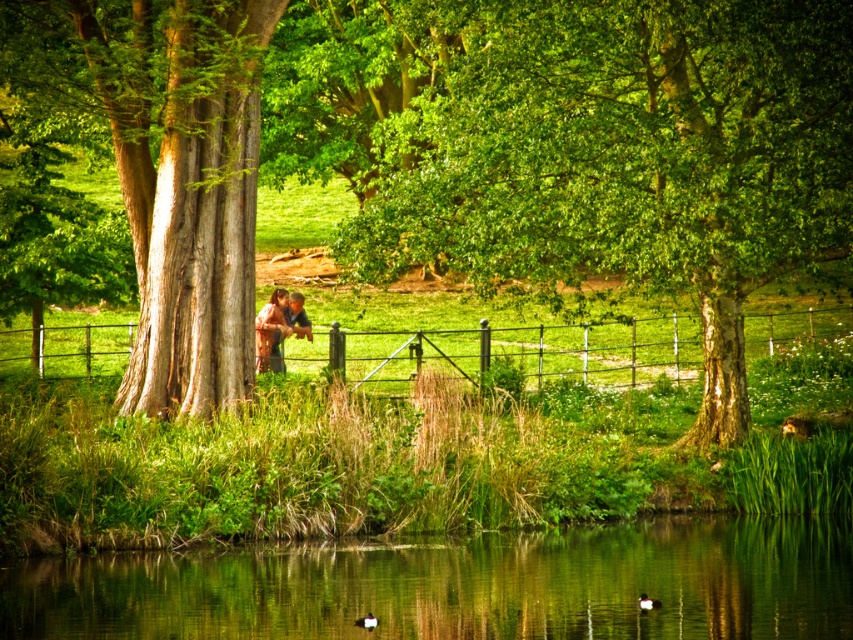
Can you confirm if transparent water at lower center is wider than rustic wooden fence at center?

In fact, transparent water at lower center might be narrower than rustic wooden fence at center.

What do you see at coordinates (461, 586) in the screenshot? I see `transparent water at lower center` at bounding box center [461, 586].

Locate an element on the screen. The image size is (853, 640). transparent water at lower center is located at coordinates (461, 586).

Find the location of a particular element. transparent water at lower center is located at coordinates (461, 586).

Consider the image. Is the position of green leafy tree at center less distant than that of matte brown jacket at center?

Yes, it is in front of matte brown jacket at center.

Does green leafy tree at center appear on the right side of matte brown jacket at center?

Correct, you'll find green leafy tree at center to the right of matte brown jacket at center.

Which is in front, point (459, 1) or point (260, 332)?

Point (459, 1) is more forward.

The width and height of the screenshot is (853, 640). I want to click on green leafy tree at center, so pos(627,156).

Is rustic wooden fence at center behind matte brown jacket at center?

No, rustic wooden fence at center is closer to the viewer.

Which is above, rustic wooden fence at center or matte brown jacket at center?

rustic wooden fence at center is higher up.

Image resolution: width=853 pixels, height=640 pixels. Identify the location of rustic wooden fence at center. (796, 360).